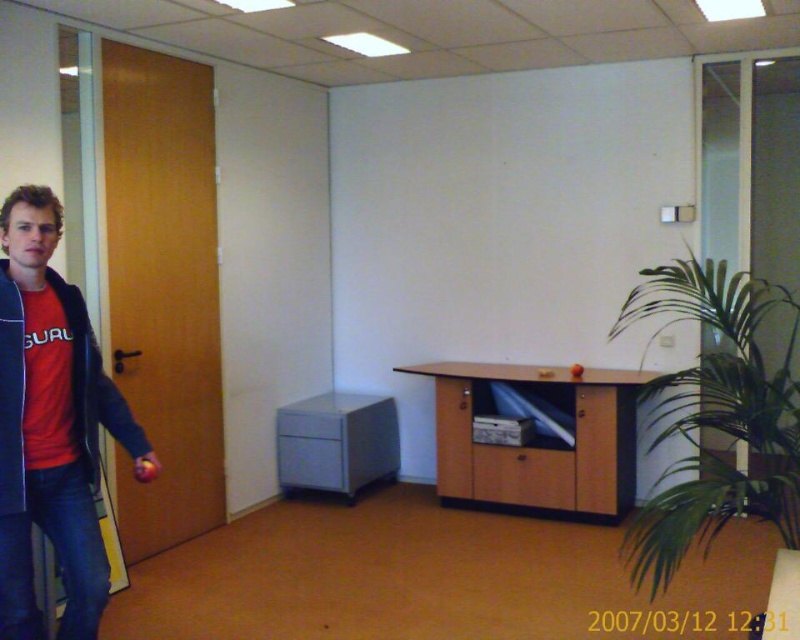
You are organizing a small event in the office and need to place a 15 cm tall decoration. You have the red cotton shirt at left and the wooden cabinet at lower right available. Which object can accommodate the decoration without it being hidden?

The red cotton shirt at left has a greater height compared to the wooden cabinet at lower right, so the decoration can be placed on the red cotton shirt at left as it is taller and less likely to hide the decoration.